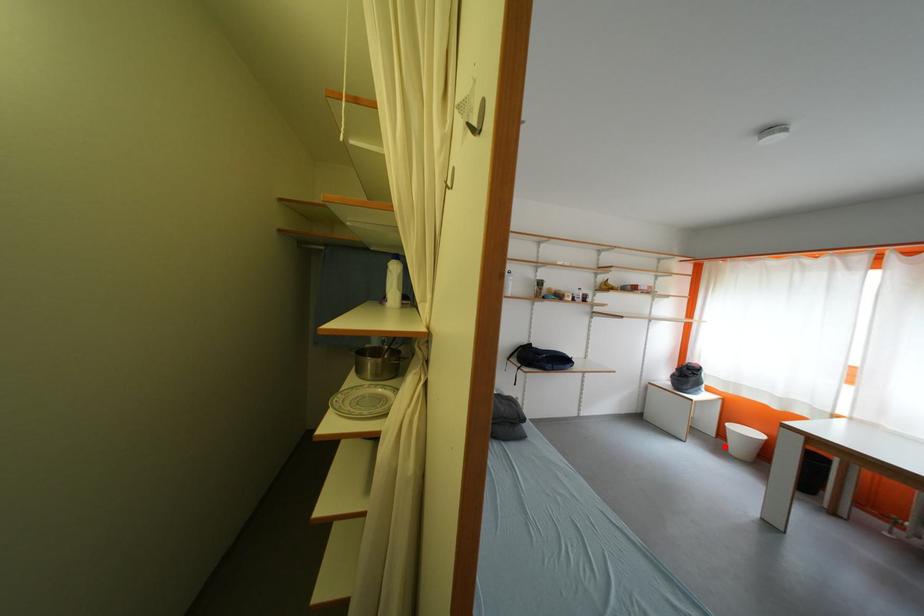
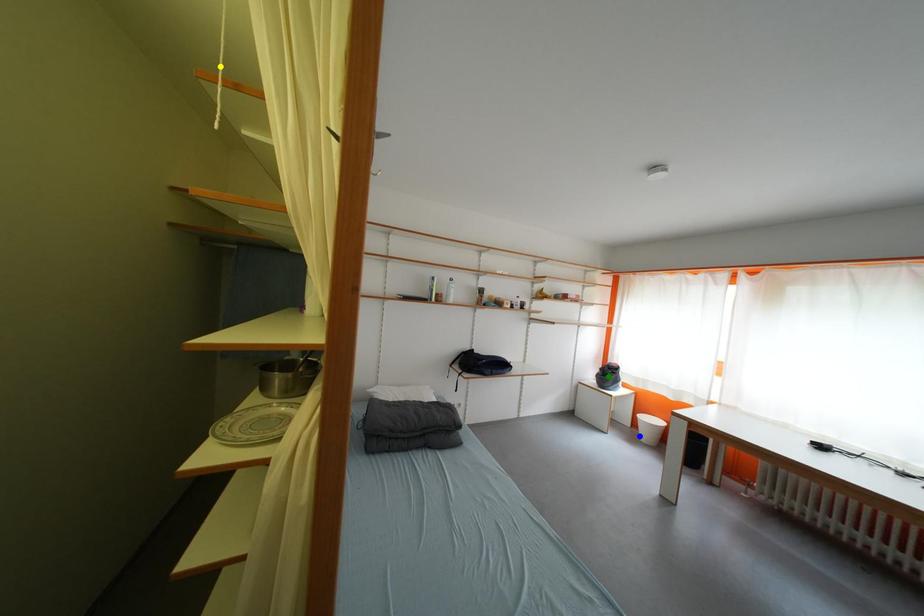
Question: I am providing you with two images of the same scene from different viewpoints. A red point is marked on the first image. You are given multiple points on the second image. In image 2, which mark is for the same physical point as the one in image 1?

Choices:
 (A) blue point
 (B) green point
 (C) yellow point

Answer: (A)